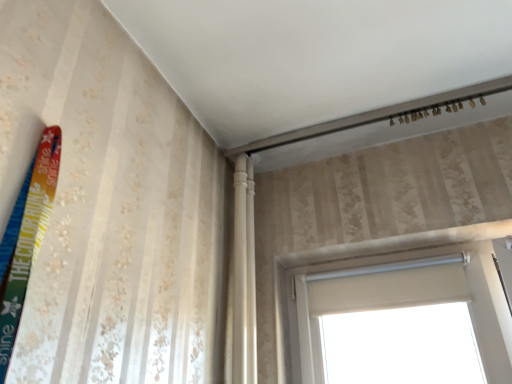
Where is `multicolored plastic ski at left`? This screenshot has width=512, height=384. multicolored plastic ski at left is located at coordinates (29, 239).

The width and height of the screenshot is (512, 384). Describe the element at coordinates (29, 239) in the screenshot. I see `multicolored plastic ski at left` at that location.

Locate an element on the screen. The image size is (512, 384). multicolored plastic ski at left is located at coordinates (29, 239).